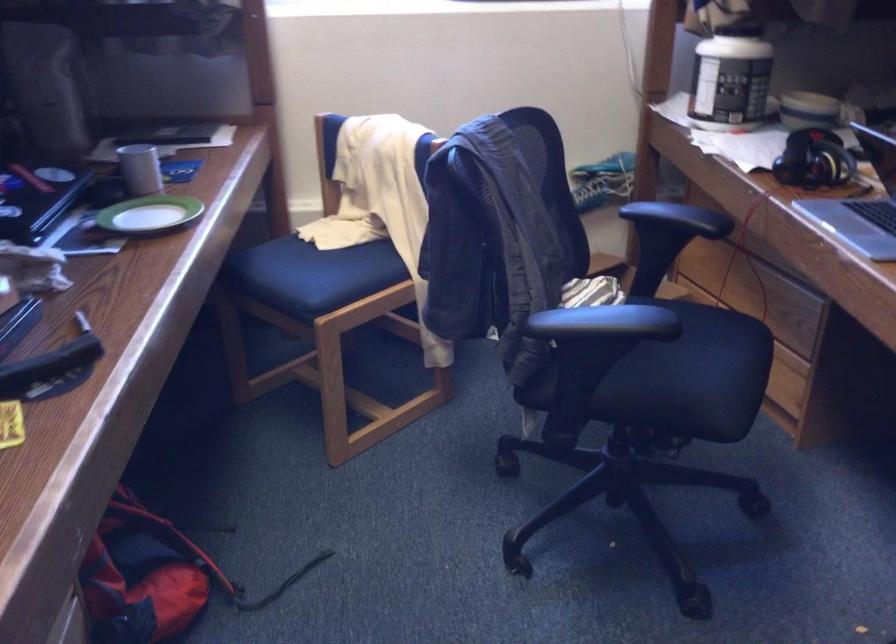
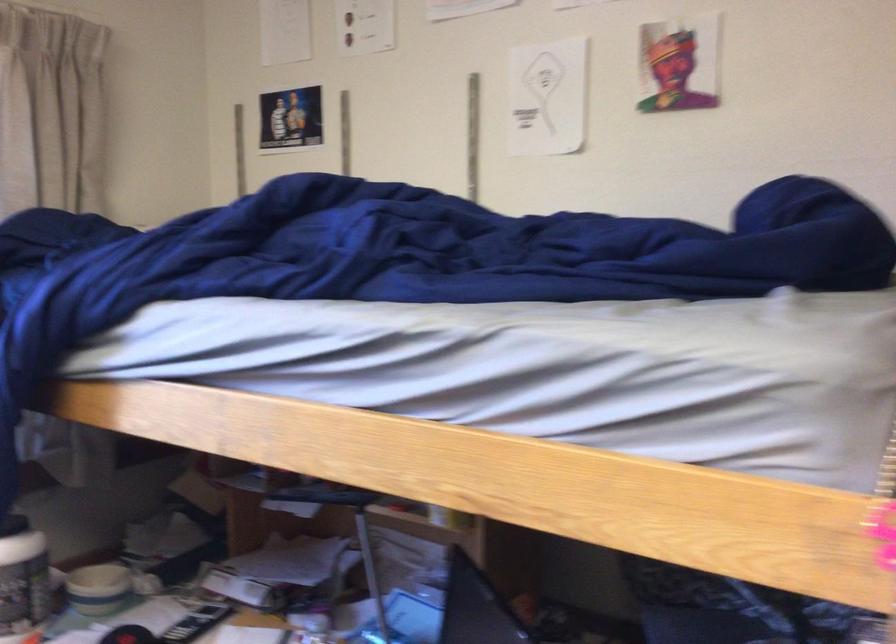
Question: The first image is from the beginning of the video and the second image is from the end. How did the camera likely rotate when shooting the video?

Choices:
 (A) Left
 (B) Right
 (C) Up
 (D) Down

Answer: (B)